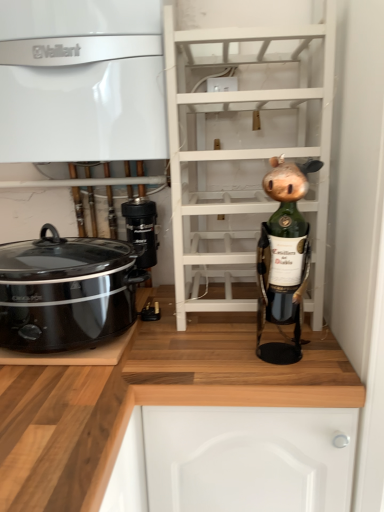
Question: Considering the positions of black plastic slow cooker at left and white glossy vaillant boiler at upper left, the second cabinetry ordered from the bottom, in the image, is black plastic slow cooker at left wider or thinner than white glossy vaillant boiler at upper left, the second cabinetry ordered from the bottom,?

Choices:
 (A) wide
 (B) thin

Answer: (B)

Question: Relative to white glossy vaillant boiler at upper left, the second cabinetry ordered from the bottom, is black plastic slow cooker at left in front or behind?

Choices:
 (A) behind
 (B) front

Answer: (B)

Question: Estimate the real-world distances between objects in this image. Which object is farther from the black plastic slow cooker at left?

Choices:
 (A) black plastic camera at center
 (B) white glossy vaillant boiler at upper left, the second cabinetry ordered from the bottom
 (C) wooden at lower right, which is counted as the 1th cabinetry, starting from the bottom
 (D) green matte wine bottle at right
 (E) white wooden shelf at center

Answer: (D)

Question: Which object is positioned farthest from the green matte wine bottle at right?

Choices:
 (A) black plastic slow cooker at left
 (B) white wooden shelf at center
 (C) black plastic camera at center
 (D) wooden at lower right, which is the second cabinetry in top-to-bottom order
 (E) white glossy vaillant boiler at upper left, placed as the first cabinetry when sorted from top to bottom

Answer: (E)